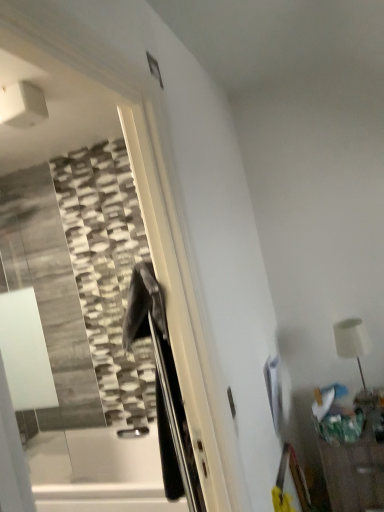
Question: Relative to wooden table at lower right, is white matte table lamp at right in front or behind?

Choices:
 (A) front
 (B) behind

Answer: (B)

Question: In terms of size, does white matte table lamp at right appear bigger or smaller than wooden table at lower right?

Choices:
 (A) small
 (B) big

Answer: (A)

Question: Is white matte table lamp at right taller or shorter than wooden table at lower right?

Choices:
 (A) tall
 (B) short

Answer: (B)

Question: In terms of size, does wooden table at lower right appear bigger or smaller than white matte table lamp at right?

Choices:
 (A) small
 (B) big

Answer: (B)

Question: From their relative heights in the image, would you say wooden table at lower right is taller or shorter than white matte table lamp at right?

Choices:
 (A) tall
 (B) short

Answer: (A)

Question: From the image's perspective, is wooden table at lower right positioned above or below white matte table lamp at right?

Choices:
 (A) above
 (B) below

Answer: (B)

Question: In the image, is wooden table at lower right positioned in front of or behind white matte table lamp at right?

Choices:
 (A) front
 (B) behind

Answer: (A)